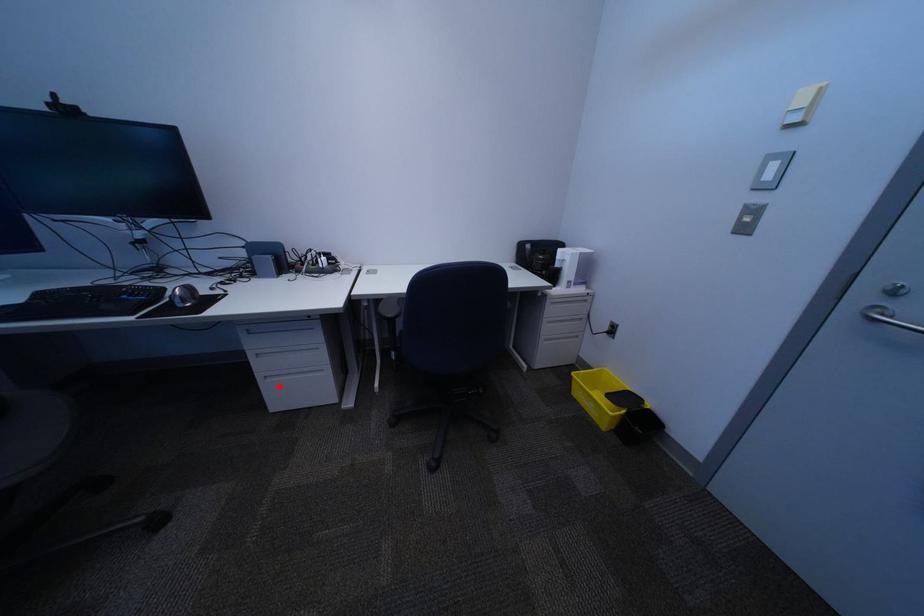
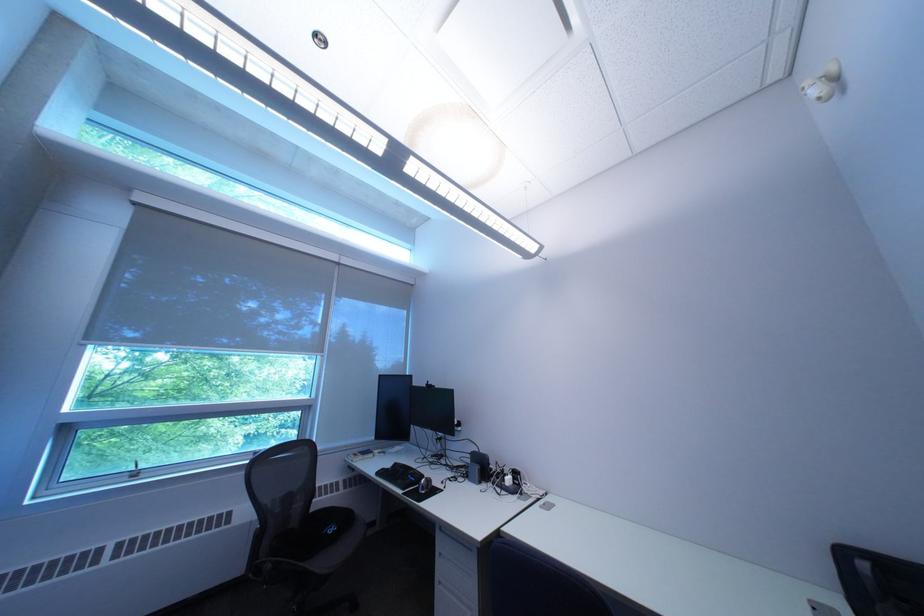
Question: I am providing you with two images of the same scene from different viewpoints. Image1 has a red point marked. In image2, the corresponding 3D location appears at what relative position? Reply with the corresponding letter.

Choices:
 (A) Closer
 (B) Farther

Answer: (B)